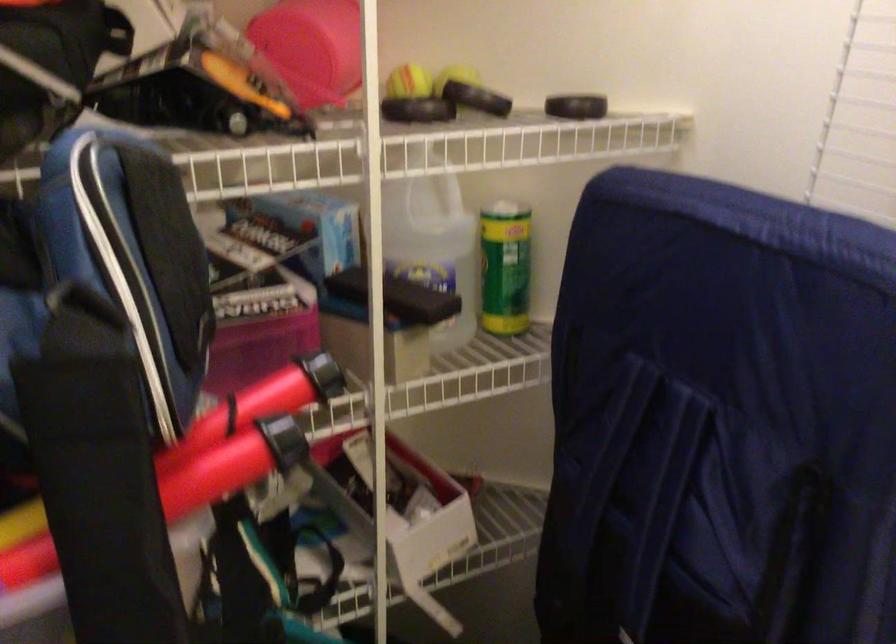
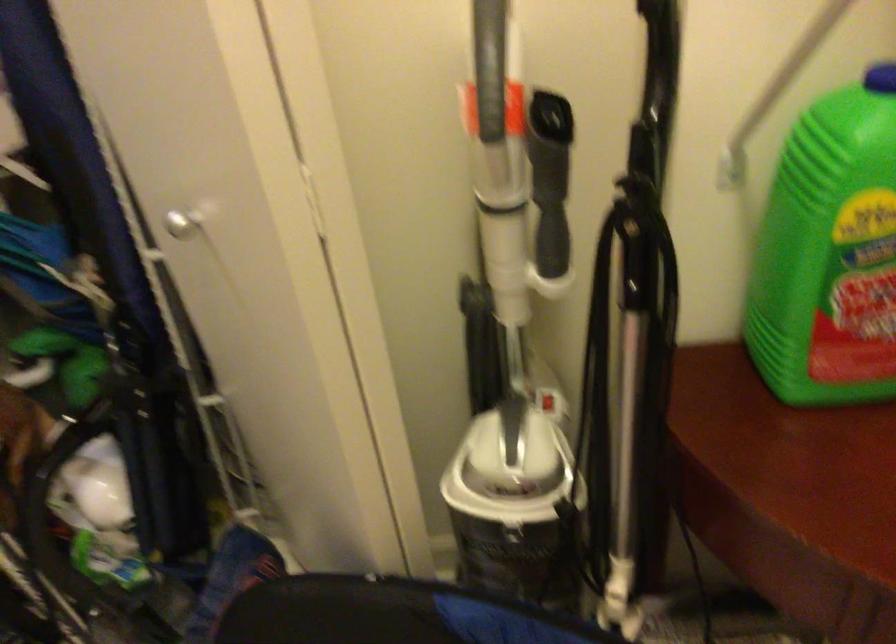
Question: In a continuous first-person perspective shot, in which direction is the camera moving?

Choices:
 (A) Left
 (B) Right
 (C) Forward
 (D) Backward

Answer: (B)